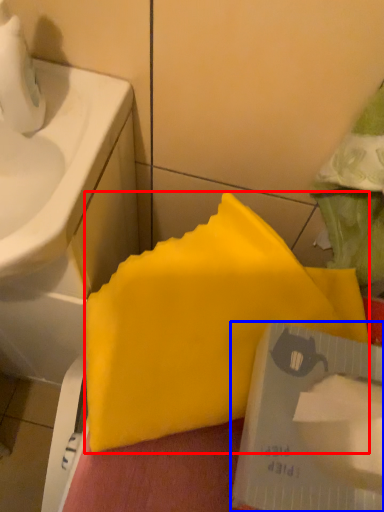
Question: Which object appears farthest to the camera in this image, waste (highlighted by a red box) or writing (highlighted by a blue box)?

Choices:
 (A) waste
 (B) writing

Answer: (A)